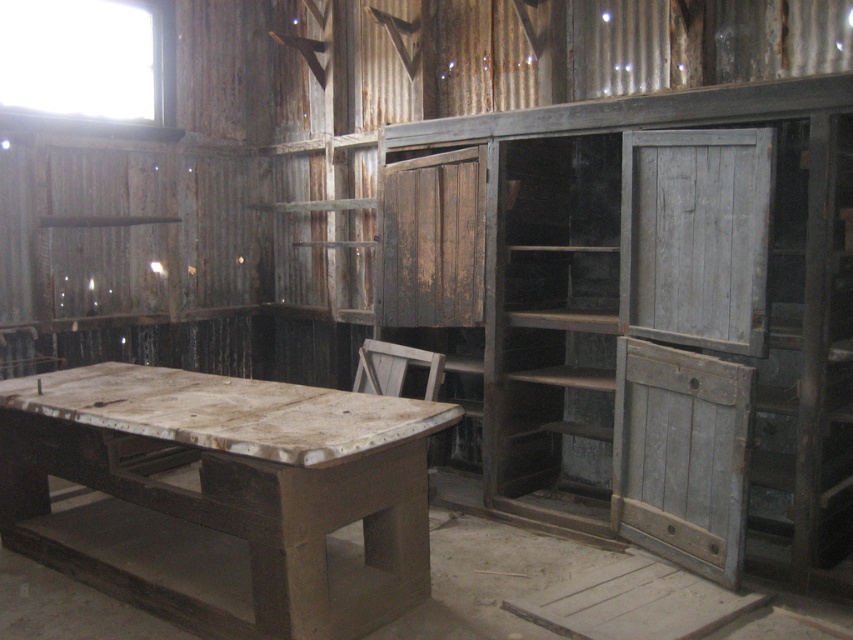
Question: Which object is closer to the camera taking this photo?

Choices:
 (A) wooden at center
 (B) weathered gray wood at center
 (C) weathered gray wood at center-right
 (D) rusty wood cabinet at center

Answer: (B)

Question: Among these points, which one is nearest to the camera?

Choices:
 (A) (476, 316)
 (B) (756, 259)
 (C) (689, 488)

Answer: (B)

Question: Can you confirm if weathered gray wood at center-right is positioned to the right of rusty wood cabinet at center?

Choices:
 (A) yes
 (B) no

Answer: (A)

Question: Which point is farther from the camera taking this photo?

Choices:
 (A) (432, 371)
 (B) (641, 416)
 (C) (445, 280)
 (D) (621, 177)

Answer: (C)

Question: Can you confirm if weathered gray wood at center is bigger than rusty wood cabinet at center?

Choices:
 (A) yes
 (B) no

Answer: (B)

Question: Does rusty wood cabinet at center have a greater width compared to wooden at center?

Choices:
 (A) no
 (B) yes

Answer: (B)